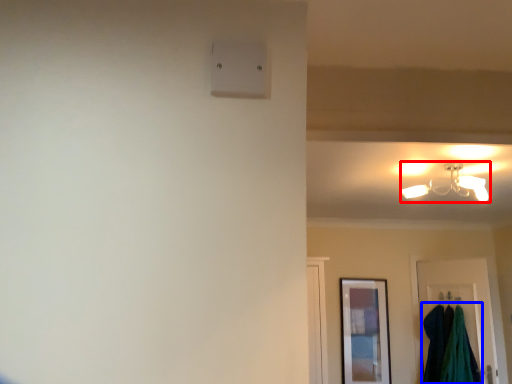
Question: Which object appears closest to the camera in this image, lamp (highlighted by a red box) or laundry (highlighted by a blue box)?

Choices:
 (A) lamp
 (B) laundry

Answer: (A)